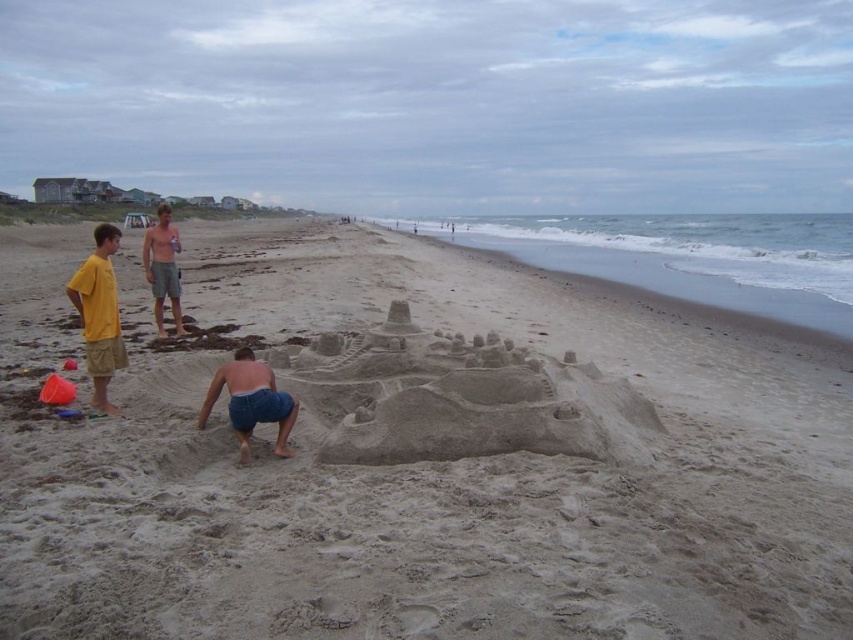
Question: Does yellow cotton shirt at left appear under blue denim shorts at center?

Choices:
 (A) no
 (B) yes

Answer: (A)

Question: Based on their relative distances, which object is farther from the shiny metallic can at center?

Choices:
 (A) smooth sandcastle at center
 (B) yellow cotton shirt at left
 (C) blue denim shorts at center

Answer: (C)

Question: Which point is closer to the camera?

Choices:
 (A) smooth sandcastle at center
 (B) shiny metallic can at center
 (C) blue denim shorts at center

Answer: (A)

Question: Which object appears closest to the camera in this image?

Choices:
 (A) blue denim shorts at center
 (B) smooth sandcastle at center
 (C) yellow cotton shirt at left
 (D) shiny metallic can at center

Answer: (B)

Question: Is smooth sandcastle at center smaller than shiny metallic can at center?

Choices:
 (A) no
 (B) yes

Answer: (A)

Question: In this image, where is blue denim shorts at center located relative to shiny metallic can at center?

Choices:
 (A) left
 (B) right

Answer: (B)